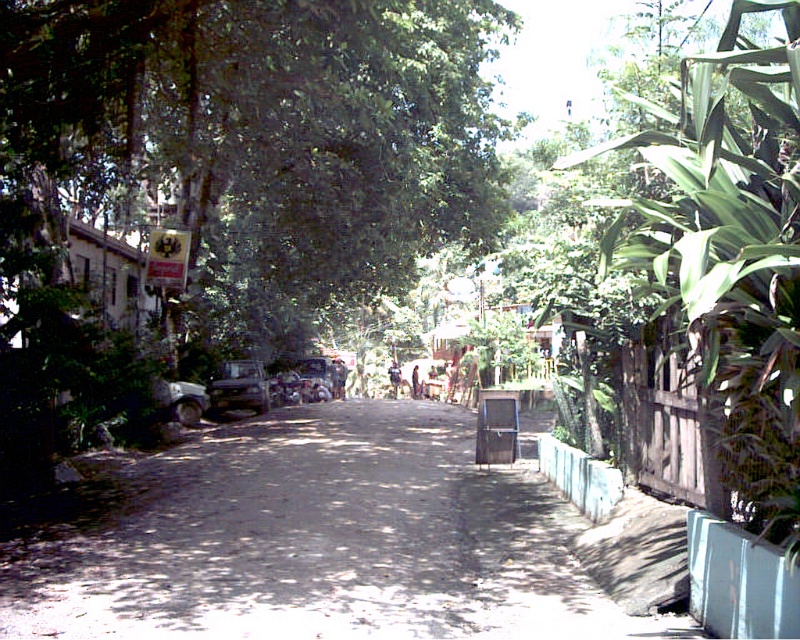
Question: Is green leafy tree at upper center bigger than metallic silver van at center?

Choices:
 (A) yes
 (B) no

Answer: (A)

Question: Which point appears closest to the camera in this image?

Choices:
 (A) (333, 362)
 (B) (233, 372)
 (C) (398, 477)

Answer: (C)

Question: Can you confirm if green leafy tree at upper center is smaller than white matte car at left?

Choices:
 (A) yes
 (B) no

Answer: (B)

Question: Based on their relative distances, which object is farther from the green leafy tree at upper center?

Choices:
 (A) white matte car at left
 (B) metallic silver car at center

Answer: (B)

Question: Is the position of white matte car at left more distant than that of metallic silver car at center?

Choices:
 (A) yes
 (B) no

Answer: (B)

Question: Based on their relative distances, which object is farther from the white matte car at left?

Choices:
 (A) green leafy tree at upper center
 (B) metallic silver van at center
 (C) dirt road at center
 (D) metallic silver car at center

Answer: (D)